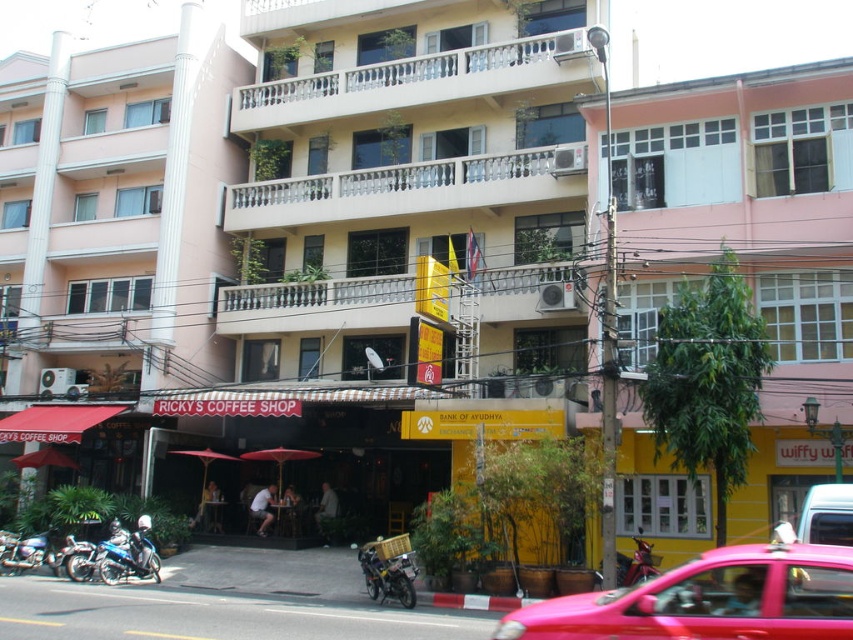
Question: Does metallic silver motorcycle at lower center appear on the left side of metallic silver motorcycle at center-right?

Choices:
 (A) no
 (B) yes

Answer: (B)

Question: Among these objects, which one is nearest to the camera?

Choices:
 (A) metallic blue motorcycle at lower left
 (B) metallic silver motorcycle at center-right

Answer: (B)

Question: Among these points, which one is farthest from the camera?

Choices:
 (A) (650, 548)
 (B) (838, 296)
 (C) (9, 540)

Answer: (C)

Question: Which object is positioned farthest from the metallic blue motorcycle at lower left?

Choices:
 (A) pink matte building at center
 (B) pink matte car at center
 (C) shiny blue motorcycle at lower left
 (D) metallic silver motorcycle at lower center

Answer: (B)

Question: Does metallic blue motorcycle at lower left lie behind metallic silver motorcycle at center-right?

Choices:
 (A) yes
 (B) no

Answer: (A)

Question: Does pink matte building at center lie behind metallic blue motorcycle at lower left?

Choices:
 (A) yes
 (B) no

Answer: (B)